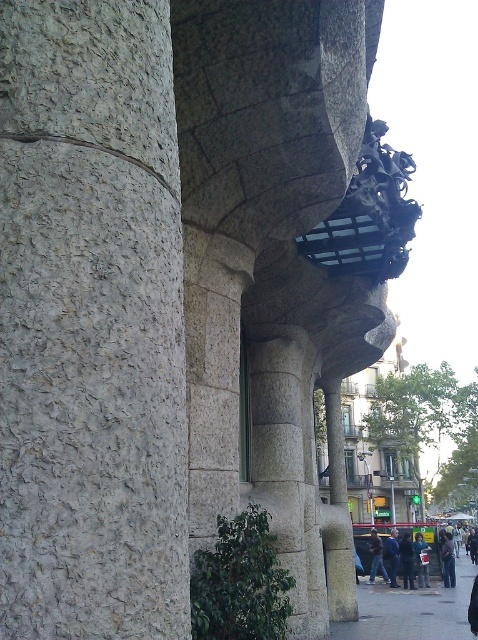
You are a photographer trying to capture a close shot of the ornate metalwork on the columns. You have a dark blue jacket at lower right and dark blue jeans at center in your frame. Which item is wider in the photo?

The dark blue jacket at lower right might be wider than dark blue jeans at center according to the description.

You are standing in front of the building and want to take a photo of the gray rough stone column at left and the dark blue jacket at lower right. Which object should you focus on first to ensure both are in the frame?

You should focus on the gray rough stone column at left first because it is in front of the dark blue jacket at lower right, so adjusting the camera to include the column will naturally include the jacket behind it.

You are standing in front of the building and see the dark blue jeans at lower right and dark blue jeans at lower center. Which pair of dark blue jeans is closer to the ground?

The dark blue jeans at lower right is positioned under the dark blue jeans at lower center, so it is closer to the ground.